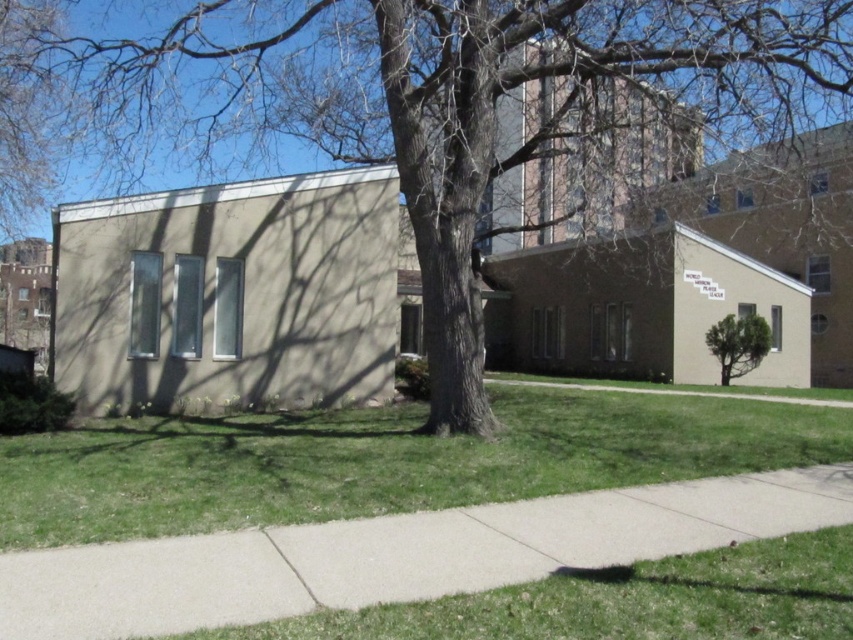
Question: Which point is closer to the camera?

Choices:
 (A) (820, 416)
 (B) (556, 566)
 (C) (392, 106)
 (D) (721, 323)

Answer: (B)

Question: Among these points, which one is nearest to the camera?

Choices:
 (A) (488, 579)
 (B) (556, 444)
 (C) (723, 321)

Answer: (A)

Question: Is brown textured tree at center positioned behind green leafy tree at lower right?

Choices:
 (A) no
 (B) yes

Answer: (A)

Question: Can you confirm if green grass at lower left is bigger than concrete sidewalk at center?

Choices:
 (A) yes
 (B) no

Answer: (A)

Question: Is brown textured tree at center to the right of concrete sidewalk at center from the viewer's perspective?

Choices:
 (A) no
 (B) yes

Answer: (A)

Question: Which is farther from the green grass at lower left?

Choices:
 (A) green leafy tree at lower right
 (B) brown textured tree at center

Answer: (A)